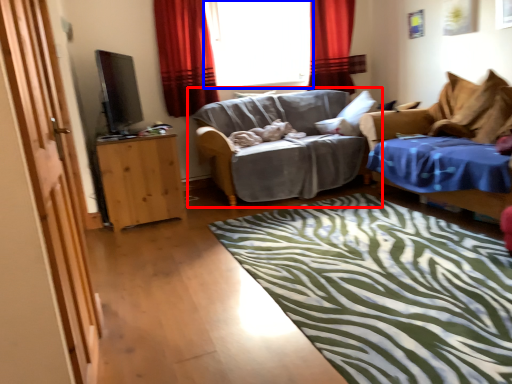
Question: Among these objects, which one is farthest to the camera, studio couch (highlighted by a red box) or window (highlighted by a blue box)?

Choices:
 (A) studio couch
 (B) window

Answer: (B)